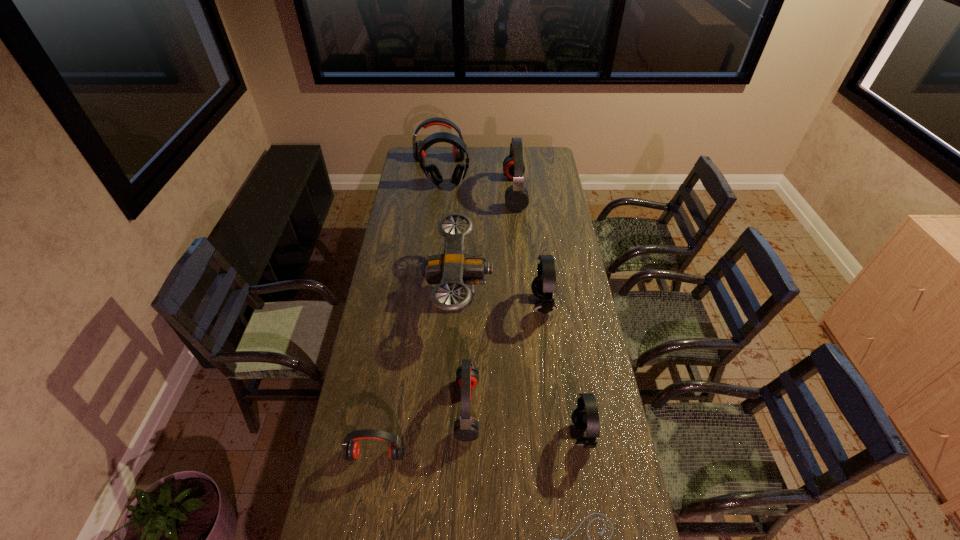
Image resolution: width=960 pixels, height=540 pixels. Find the location of `the biggest red earphone`. the biggest red earphone is located at coordinates (516, 196).

Find the location of a particular element. Image resolution: width=960 pixels, height=540 pixels. the third nearest red earphone is located at coordinates (516, 196).

The width and height of the screenshot is (960, 540). In order to click on the farthest black earphone in this screenshot , I will do `click(431, 171)`.

Identify the location of the biggest black earphone. Image resolution: width=960 pixels, height=540 pixels. (431, 171).

Find the location of a particular element. The image size is (960, 540). the farthest object is located at coordinates (457, 154).

What are the coordinates of `the farthest red earphone` in the screenshot? It's located at (457, 154).

I want to click on the fourth farthest earphone, so click(x=543, y=285).

Identify the location of the second nearest black earphone. (543, 285).

Image resolution: width=960 pixels, height=540 pixels. Identify the location of drone. (453, 268).

The width and height of the screenshot is (960, 540). I want to click on the third red earphone from left to right, so click(466, 428).